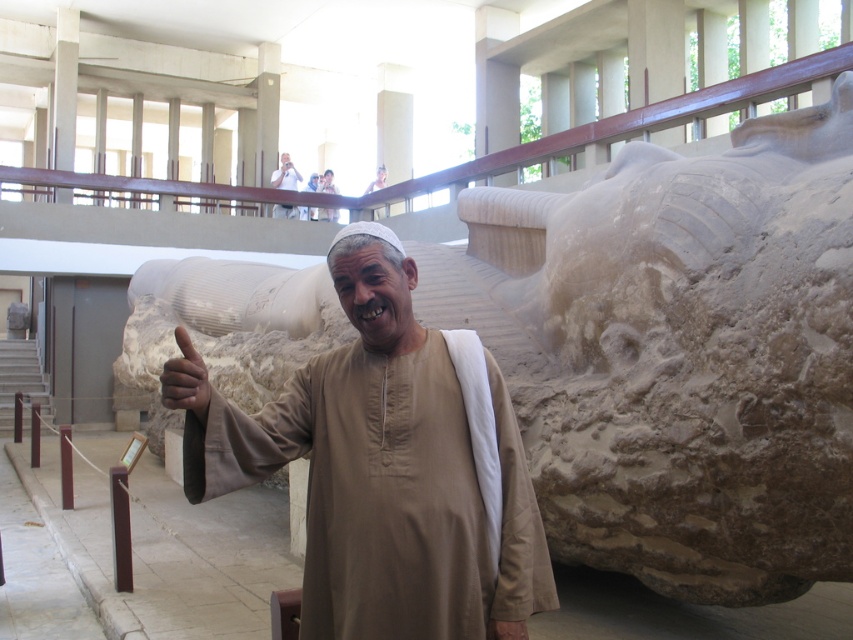
Who is higher up, dark brown skin at thumb right or matte beige statue at upper center?

matte beige statue at upper center is higher up.

This screenshot has height=640, width=853. Find the location of `dark brown skin at thumb right`. dark brown skin at thumb right is located at coordinates (184, 378).

Identify the location of dark brown skin at thumb right. The width and height of the screenshot is (853, 640). (184, 378).

Is brown matte shirt at center above matte beige statue at upper center?

Actually, brown matte shirt at center is below matte beige statue at upper center.

Which is more to the left, brown matte shirt at center or matte beige statue at upper center?

matte beige statue at upper center is more to the left.

Which is behind, point (361, 401) or point (273, 179)?

Positioned behind is point (273, 179).

What are the coordinates of `brown matte shirt at center` in the screenshot? It's located at (390, 470).

Is point (195, 392) positioned behind point (335, 218)?

No, (195, 392) is closer to viewer.

Can you confirm if dark brown skin at thumb right is positioned to the right of white cotton robe at center?

Correct, you'll find dark brown skin at thumb right to the right of white cotton robe at center.

This screenshot has width=853, height=640. Describe the element at coordinates (184, 378) in the screenshot. I see `dark brown skin at thumb right` at that location.

The image size is (853, 640). Find the location of `dark brown skin at thumb right`. dark brown skin at thumb right is located at coordinates (184, 378).